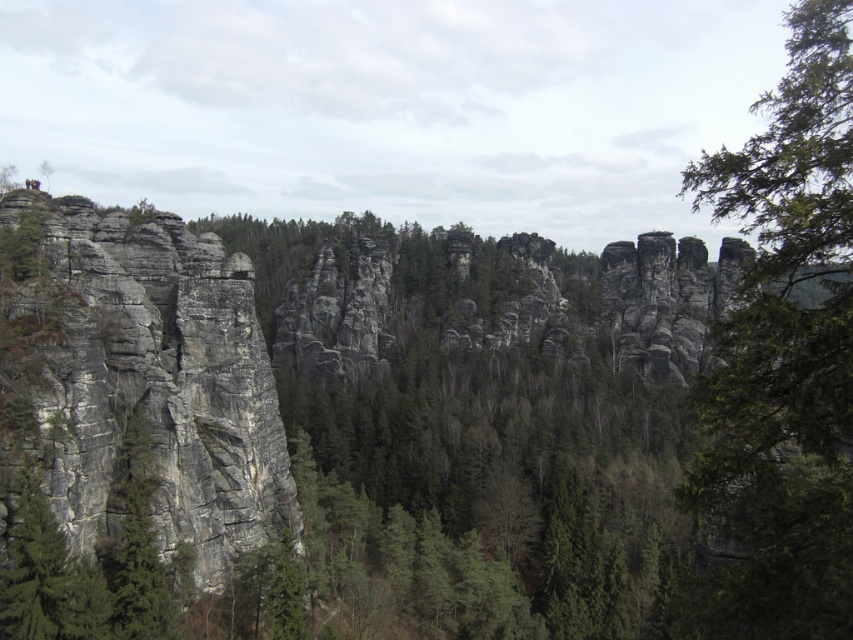
You are standing in the landscape and want to take a photo of both the green leafy tree at right and the gray rough rock face at left. Which object should you adjust your camera focus on first to ensure both are in focus?

You should focus on the gray rough rock face at left first because it is farther away than the green leafy tree at right, ensuring depth of field captures both.

You are planning to plant a new tree in this landscape. The green leafy tree at right and the green matte tree at upper left are already present. Which tree has a wider spread when viewed from above?

The green leafy tree at right has a wider spread than the green matte tree at upper left because its width surpasses the latter.